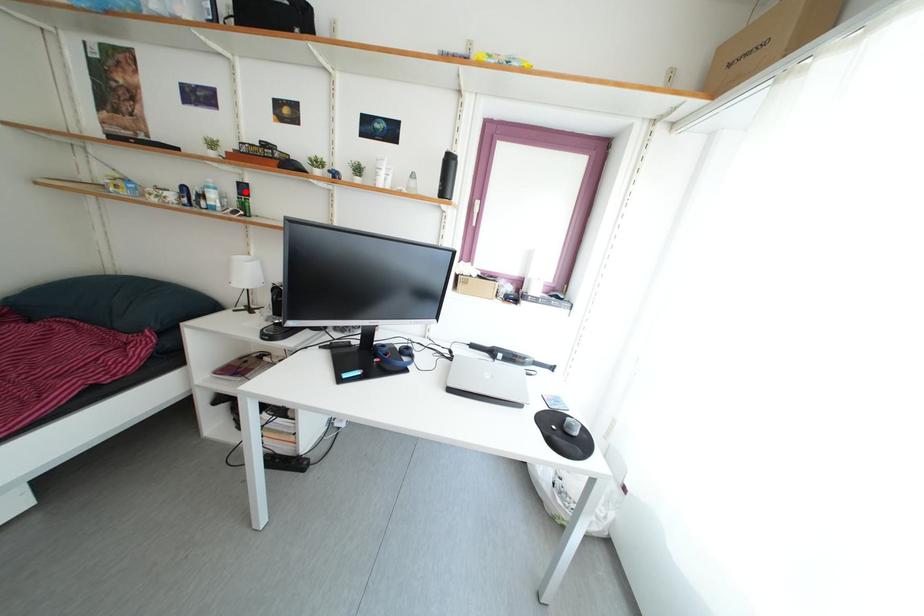
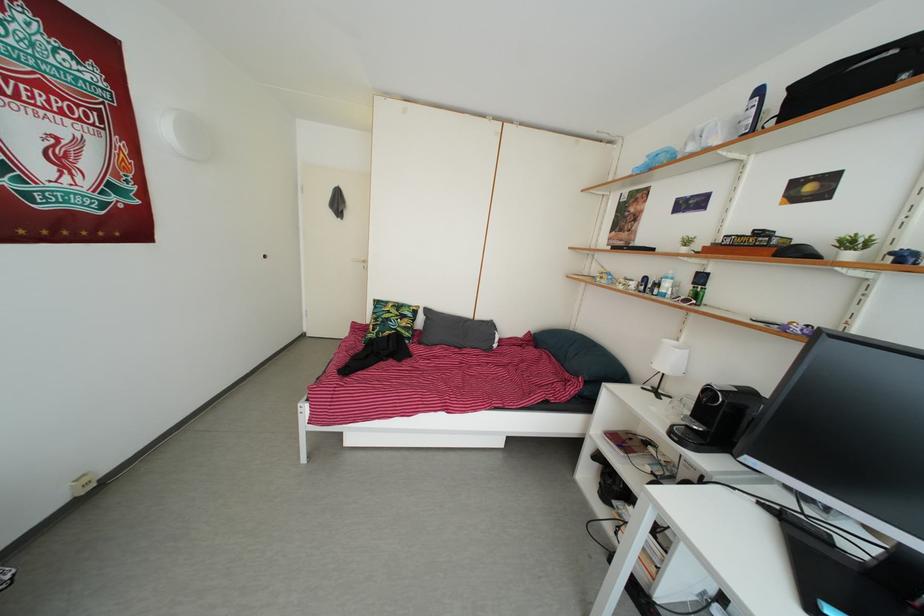
In the second image, find the point that corresponds to the highlighted location in the first image.

(704, 282)